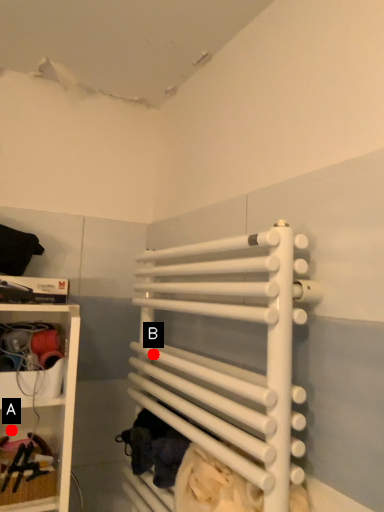
Question: Two points are circled on the image, labeled by A and B beside each circle. Among these points, which one is farthest from the camera?

Choices:
 (A) A is further
 (B) B is further

Answer: (A)